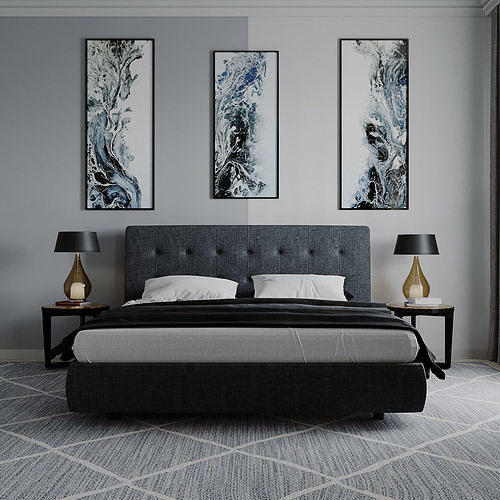
Locate an element on the screen. carpet is located at coordinates (47, 466), (261, 481), (465, 417).